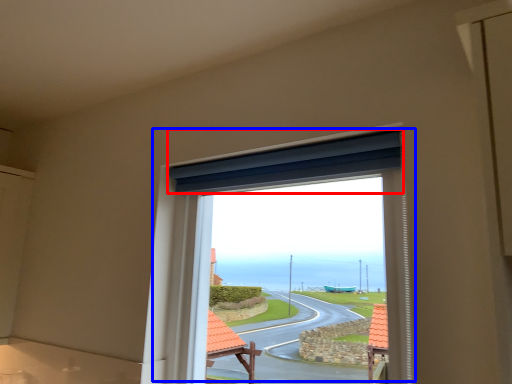
Question: Which of the following is the farthest to the observer, curtain (highlighted by a red box) or window (highlighted by a blue box)?

Choices:
 (A) curtain
 (B) window

Answer: (A)